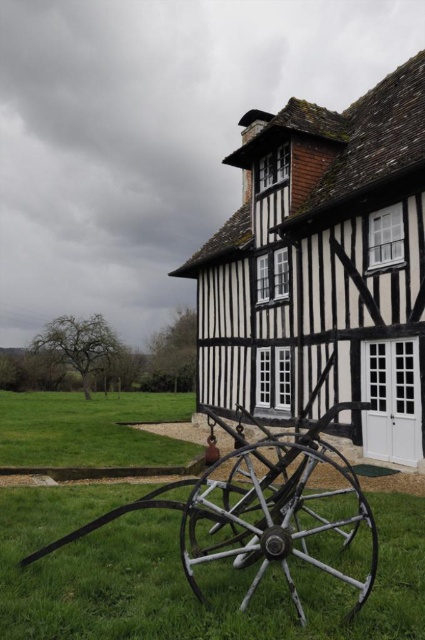
Question: Can you confirm if green grass at lower center is smaller than green grass at lower left?

Choices:
 (A) yes
 (B) no

Answer: (A)

Question: Is green grass at lower center below green grass at lower left?

Choices:
 (A) no
 (B) yes

Answer: (A)

Question: Among these objects, which one is farthest from the camera?

Choices:
 (A) green grass at lower left
 (B) green grass at lower center

Answer: (A)

Question: Which point is closer to the camera?

Choices:
 (A) (221, 547)
 (B) (399, 493)
 (C) (14, 449)

Answer: (A)

Question: Is green grass at lower center thinner than metallic silver wagon wheel at lower center?

Choices:
 (A) no
 (B) yes

Answer: (A)

Question: Which object is farther from the camera taking this photo?

Choices:
 (A) green grass at lower center
 (B) metallic silver wagon wheel at lower center
 (C) green grass at lower left

Answer: (C)